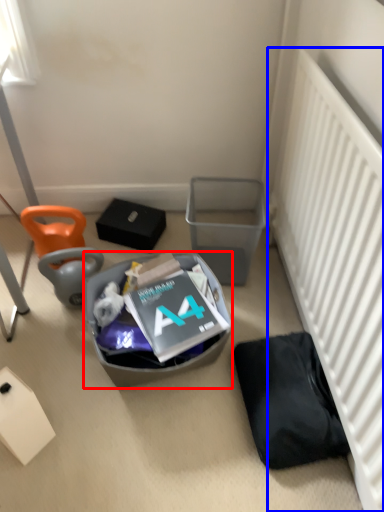
Question: Which point is further to the camera, trash bin/can (highlighted by a red box) or radiator (highlighted by a blue box)?

Choices:
 (A) trash bin/can
 (B) radiator

Answer: (A)